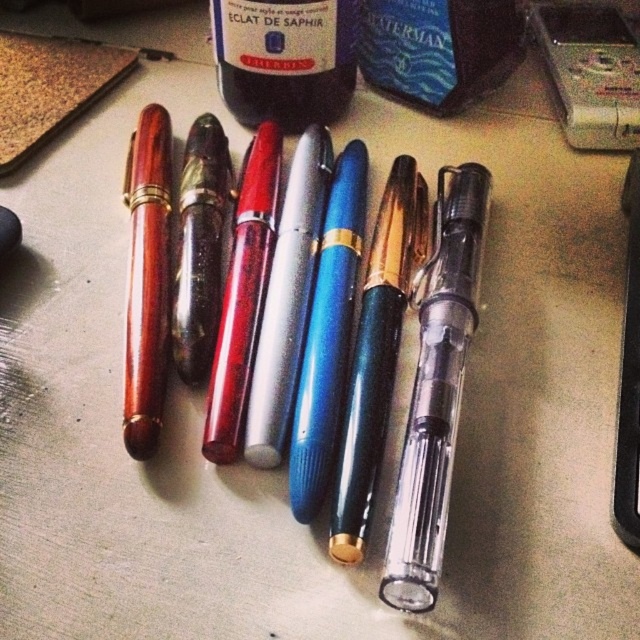
In the scene shown: You have a small box that can only fit items narrower than the wooden pen at left. Can the translucent glass bottle at center fit into the box?

The translucent glass bottle at center is wider than the wooden pen at left, so it cannot fit into the box designed for items narrower than the wooden pen at left.

You are organizing a display of stationery items and need to place the wooden pen at left and the translucent glass bottle at center. According to the spatial arrangement in the image, which item is closer to the viewer?

The translucent glass bottle at center is closer to the viewer because the wooden pen at left is behind it.